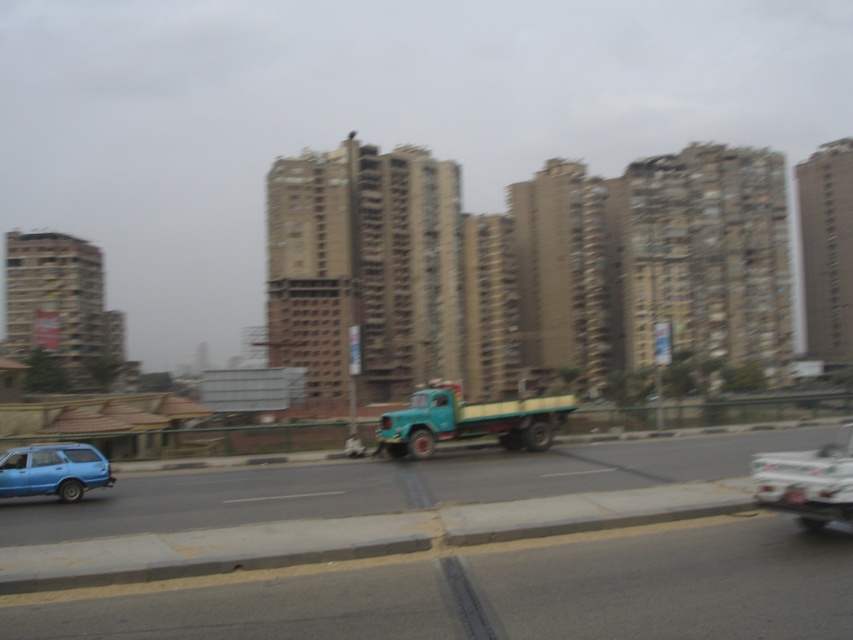
Between matte green truck at center and metallic blue truck at center, which one is positioned lower?

matte green truck at center

Who is shorter, matte green truck at center or metallic blue truck at center?

Standing shorter between the two is matte green truck at center.

Measure the distance between point (x=193, y=513) and camera.

They are 52.02 feet apart.

Where is `matte green truck at center`? The image size is (853, 640). matte green truck at center is located at coordinates (384, 484).

Is metallic blue truck at center thinner than matte blue car at lower left?

Incorrect, metallic blue truck at center's width is not less than matte blue car at lower left's.

Which is below, metallic blue truck at center or matte blue car at lower left?

matte blue car at lower left is below.

Locate an element on the screen. This screenshot has width=853, height=640. metallic blue truck at center is located at coordinates (807, 481).

Between teal matte truck at center and matte blue car at lower left, which one has more height?

With more height is teal matte truck at center.

Can you confirm if teal matte truck at center is positioned to the right of matte blue car at lower left?

Correct, you'll find teal matte truck at center to the right of matte blue car at lower left.

Between point (566, 397) and point (67, 480), which one is positioned behind?

The point (566, 397) is more distant.

You are a GUI agent. You are given a task and a screenshot of the screen. Output one action in this format:
    pyautogui.click(x=<x>, y=<y>)
    Task: Click on the teal matte truck at center
    This screenshot has width=853, height=640.
    Given the screenshot: What is the action you would take?
    pyautogui.click(x=469, y=420)